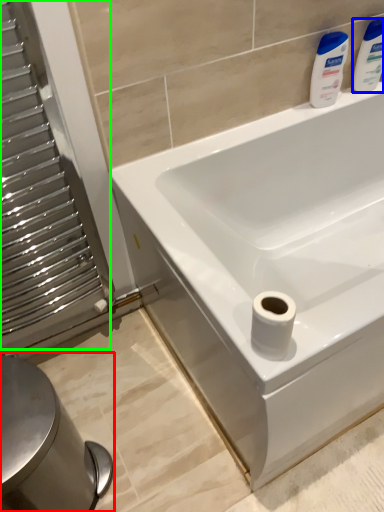
Question: Based on their relative distances, which object is nearer to bidet (highlighted by a red box)? Choose from cleaning product (highlighted by a blue box) and screen door (highlighted by a green box).

Choices:
 (A) cleaning product
 (B) screen door

Answer: (B)